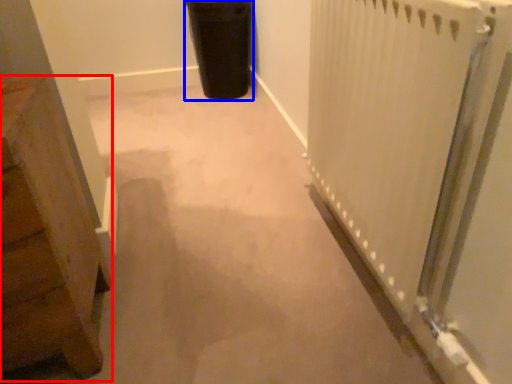
Question: Which point is closer to the camera, furniture (highlighted by a red box) or garbage (highlighted by a blue box)?

Choices:
 (A) furniture
 (B) garbage

Answer: (A)